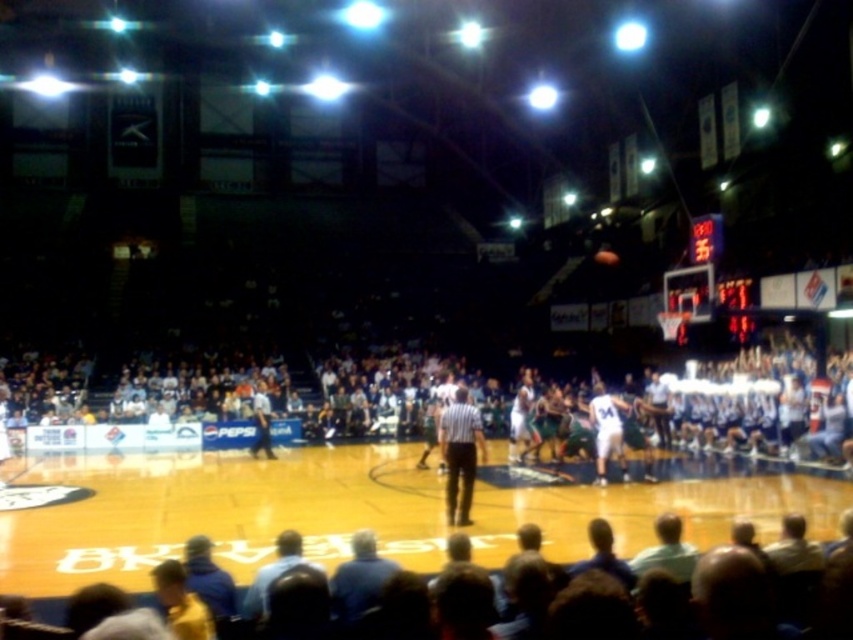
Question: Which of the following is the farthest from the observer?

Choices:
 (A) white jersey at center
 (B) white shirt at center
 (C) wooden polished basketball court at center
 (D) light blue shirt at lower center

Answer: (A)

Question: Can you confirm if white shirt at center is wider than white jersey at center?

Choices:
 (A) no
 (B) yes

Answer: (A)

Question: Is white jersey at center further to camera compared to shiny orange basketball at center?

Choices:
 (A) yes
 (B) no

Answer: (B)

Question: Does light blue shirt at lower center lie in front of shiny orange basketball at center?

Choices:
 (A) yes
 (B) no

Answer: (A)

Question: Which object is farther from the camera taking this photo?

Choices:
 (A) white jersey at center
 (B) white shirt at center

Answer: (A)

Question: Which object is the closest to the shiny orange basketball at center?

Choices:
 (A) white shirt at center
 (B) light blue shirt at lower center
 (C) white jersey at center

Answer: (C)